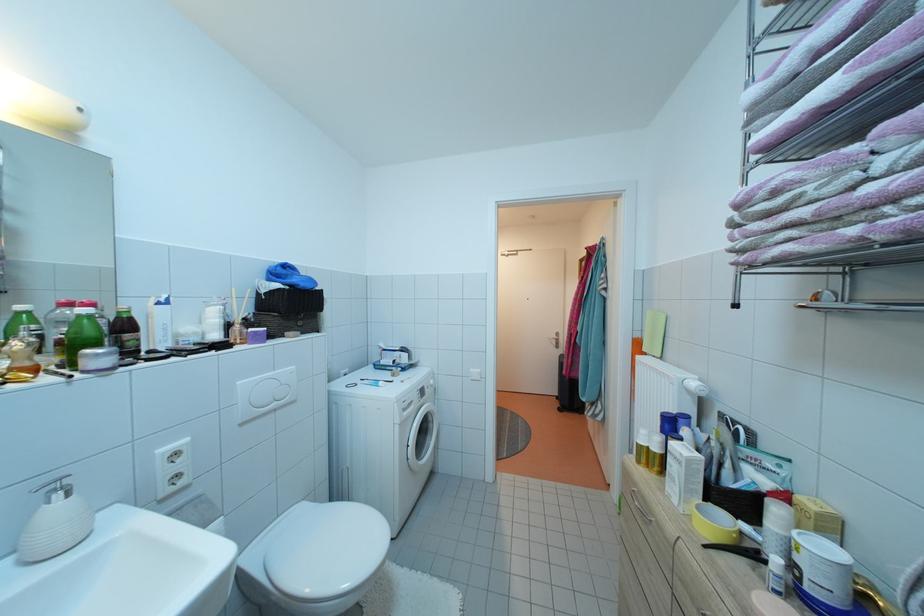
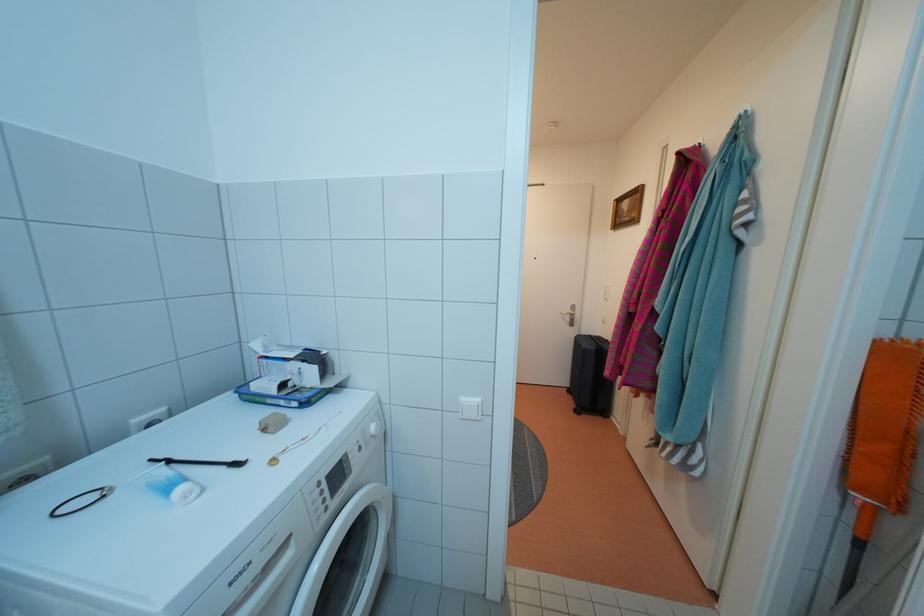
Where in the second image is the point corresponding to the point at 565,403 from the first image?

(576, 397)